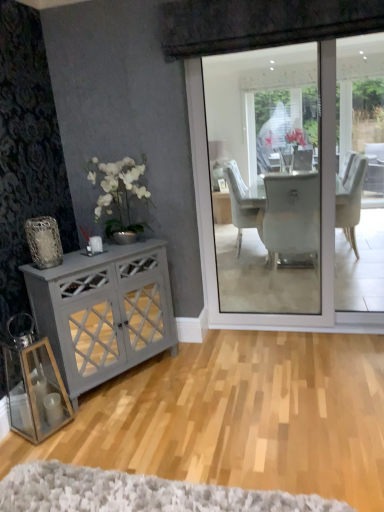
This screenshot has width=384, height=512. I want to click on free point above matte gray cabinet at left (from a real-world perspective), so click(95, 254).